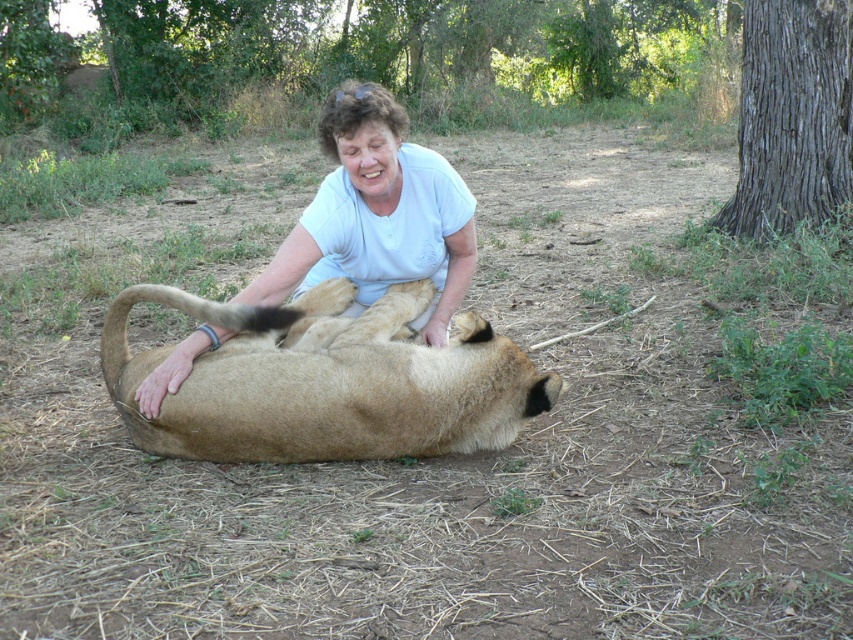
Question: Is golden fur lion at center thinner than white smooth shirt at center?

Choices:
 (A) yes
 (B) no

Answer: (B)

Question: Which object is closer to the camera taking this photo?

Choices:
 (A) white smooth shirt at center
 (B) golden fur lion at center

Answer: (B)

Question: Is golden fur lion at center wider than white smooth shirt at center?

Choices:
 (A) yes
 (B) no

Answer: (A)

Question: Which object is closer to the camera taking this photo?

Choices:
 (A) golden fur lion at center
 (B) white smooth shirt at center

Answer: (A)

Question: Is golden fur lion at center to the right of white smooth shirt at center from the viewer's perspective?

Choices:
 (A) no
 (B) yes

Answer: (B)